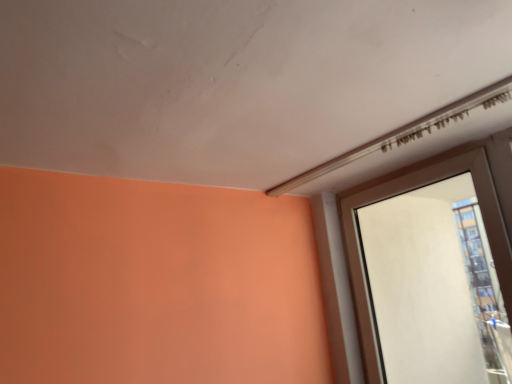
What do you see at coordinates (407, 191) in the screenshot? I see `matte glass window at right` at bounding box center [407, 191].

Find the location of a particular element. The width and height of the screenshot is (512, 384). matte glass window at right is located at coordinates (407, 191).

Where is `matte glass window at right`? matte glass window at right is located at coordinates (407, 191).